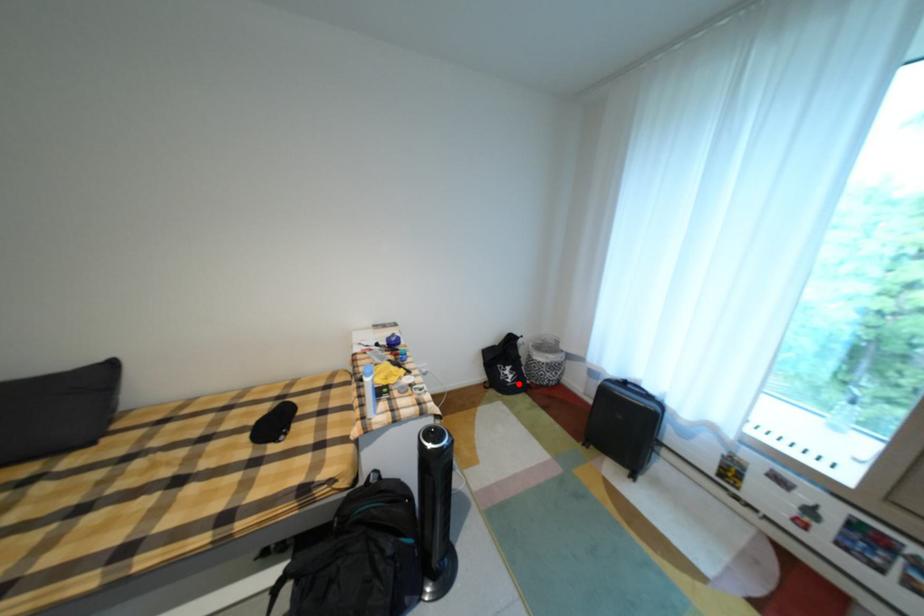
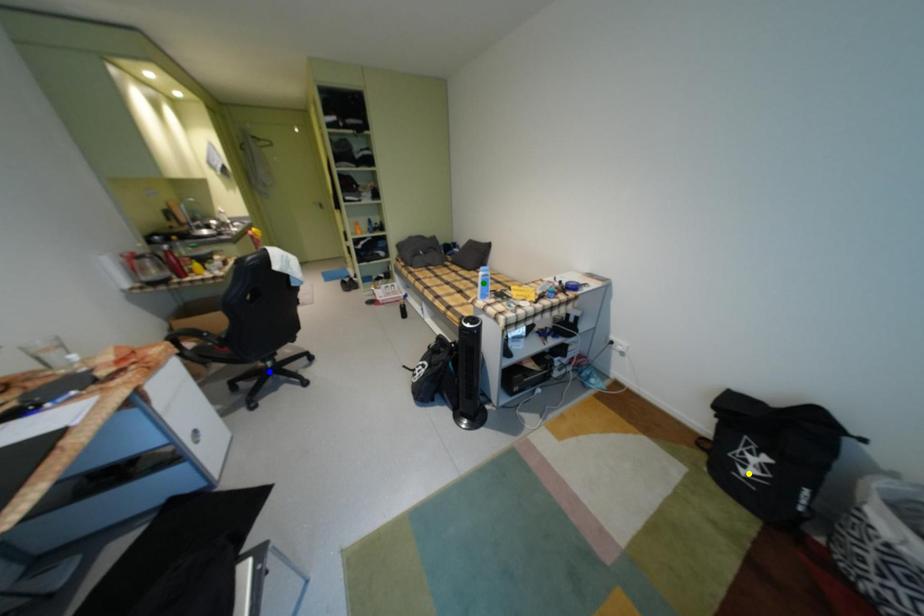
Question: I am providing you with two images of the same scene from different viewpoints. A red point is marked on the first image. You are given multiple points on the second image. Which point in image 2 is actually the same real-world point as the red point in image 1?

Choices:
 (A) green point
 (B) yellow point
 (C) blue point

Answer: (B)